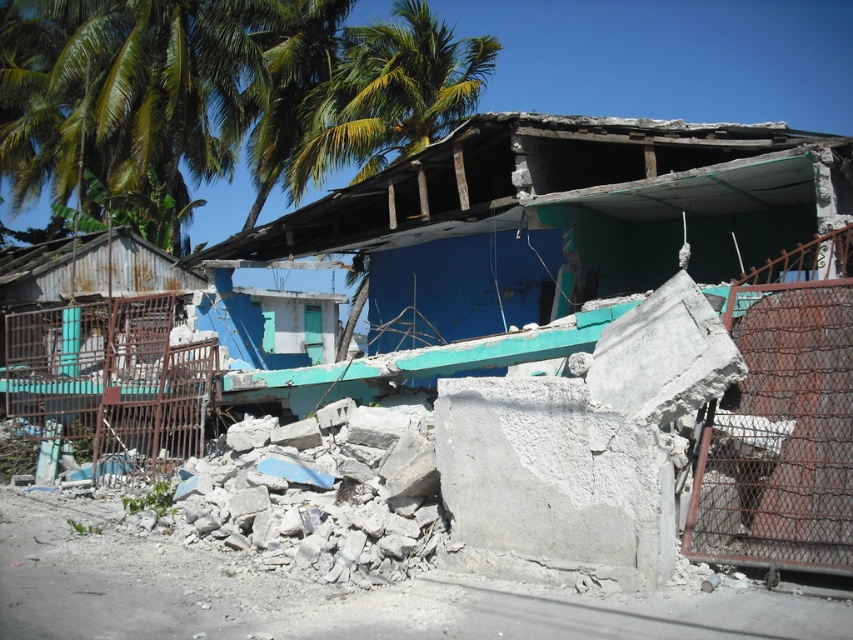
You are a construction worker assessing the damage. You notice the rusty metal fence at left and the green leafy palm tree at upper center. Which object is narrower in width?

The rusty metal fence at left has a lesser width compared to the green leafy palm tree at upper center, so the rusty metal fence at left is narrower.

You are a rescue worker assessing the scene. You notice the rusty metal gate at right and the green leafy palm tree at upper left. Which object is nearer to you?

The rusty metal gate at right is closer to the viewer than the green leafy palm tree at upper left.